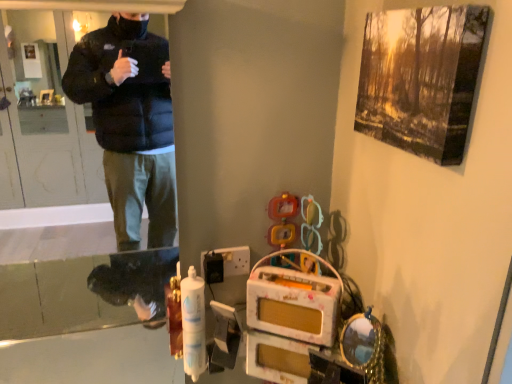
Question: Is transparent plastic screen door at left bigger than black plastic switch at lower center?

Choices:
 (A) no
 (B) yes

Answer: (B)

Question: Can you confirm if transparent plastic screen door at left is positioned to the right of black plastic switch at lower center?

Choices:
 (A) no
 (B) yes

Answer: (A)

Question: From a real-world perspective, does transparent plastic screen door at left sit lower than black plastic switch at lower center?

Choices:
 (A) no
 (B) yes

Answer: (A)

Question: Is transparent plastic screen door at left looking in the opposite direction of black plastic switch at lower center?

Choices:
 (A) yes
 (B) no

Answer: (B)

Question: Is transparent plastic screen door at left further to the viewer compared to black plastic switch at lower center?

Choices:
 (A) no
 (B) yes

Answer: (A)

Question: Can you confirm if transparent plastic screen door at left is taller than black plastic switch at lower center?

Choices:
 (A) no
 (B) yes

Answer: (B)

Question: Considering the relative sizes of black plastic switch at lower center and transparent plastic screen door at left in the image provided, is black plastic switch at lower center smaller than transparent plastic screen door at left?

Choices:
 (A) yes
 (B) no

Answer: (A)

Question: Is black plastic switch at lower center closer to the viewer compared to transparent plastic screen door at left?

Choices:
 (A) no
 (B) yes

Answer: (A)

Question: Is black plastic switch at lower center far from transparent plastic screen door at left?

Choices:
 (A) yes
 (B) no

Answer: (A)

Question: Does black plastic switch at lower center turn towards transparent plastic screen door at left?

Choices:
 (A) no
 (B) yes

Answer: (A)

Question: Would you say black plastic switch at lower center contains transparent plastic screen door at left?

Choices:
 (A) no
 (B) yes

Answer: (A)

Question: From a real-world perspective, is black plastic switch at lower center on top of transparent plastic screen door at left?

Choices:
 (A) yes
 (B) no

Answer: (B)

Question: Visually, is black plastic switch at lower center positioned to the left or to the right of transparent plastic screen door at left?

Choices:
 (A) right
 (B) left

Answer: (A)